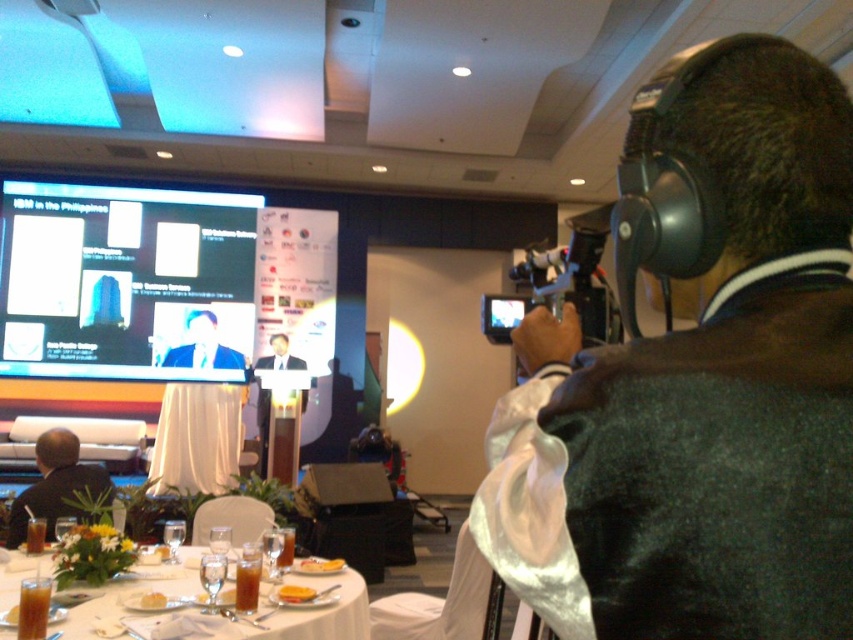
You are organizing a presentation and need to decide where to place a 3D model of a new product. The model is 1.2 meters wide. The matte black screen at upper left and the white glossy table at lower center are both potential locations. Based on their sizes, can the 3D model fit on either of them?

The matte black screen at upper left might be wider than the white glossy table at lower center. Since the 3D model is 1.2 meters wide, if the screen is indeed wider, it could accommodate the model. However, without exact measurements, it is uncertain. The table might not be wide enough if the screen is wider, but again, specifics are needed. Please verify the actual dimensions before deciding.